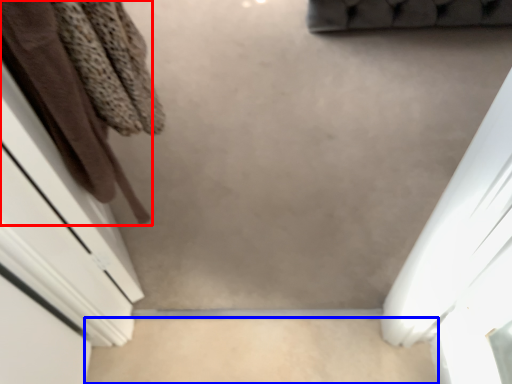
Question: Among these objects, which one is nearest to the camera, clothing (highlighted by a red box) or concrete (highlighted by a blue box)?

Choices:
 (A) clothing
 (B) concrete

Answer: (A)